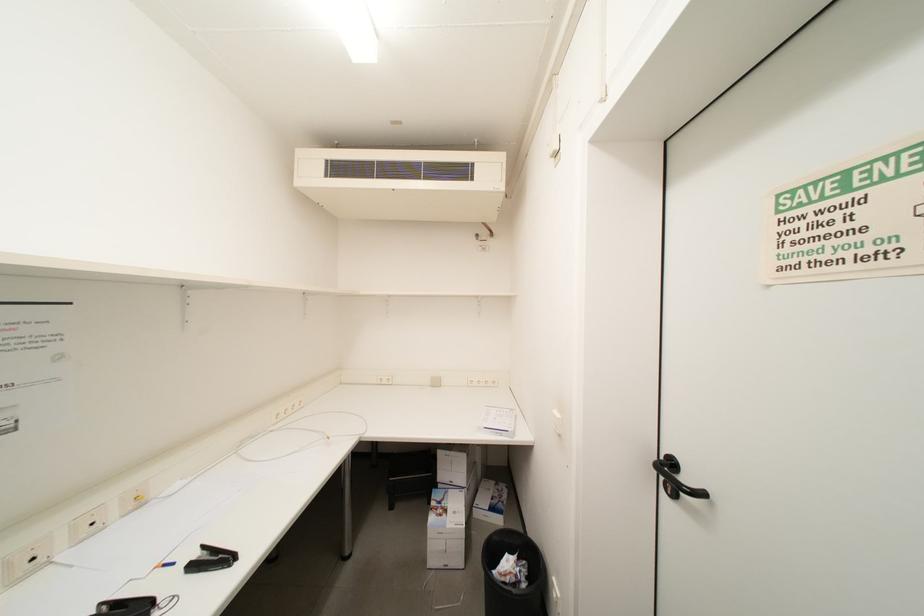
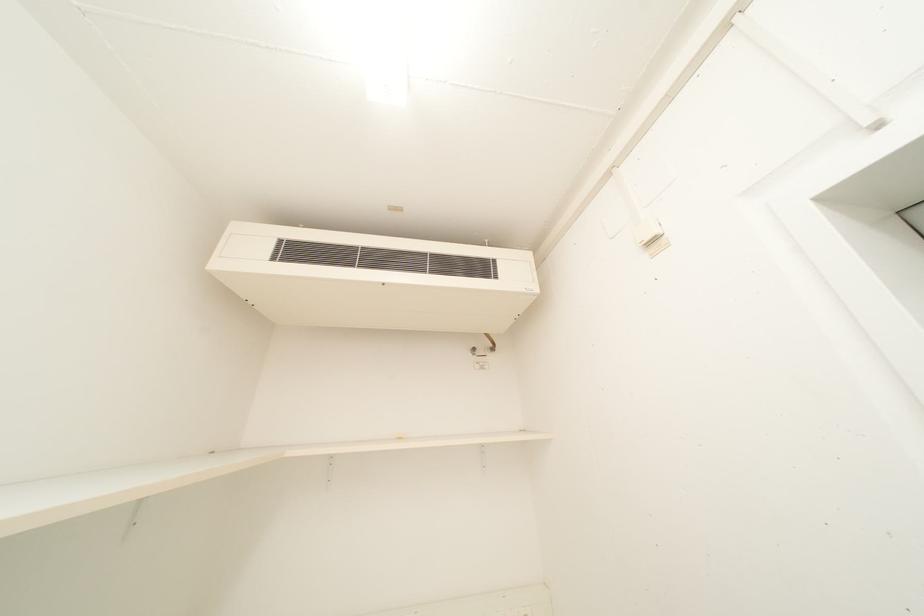
Question: Based on the continuous images, in which direction is the camera rotating? Reply with the corresponding letter.

Choices:
 (A) Left
 (B) Right
 (C) Up
 (D) Down

Answer: (C)